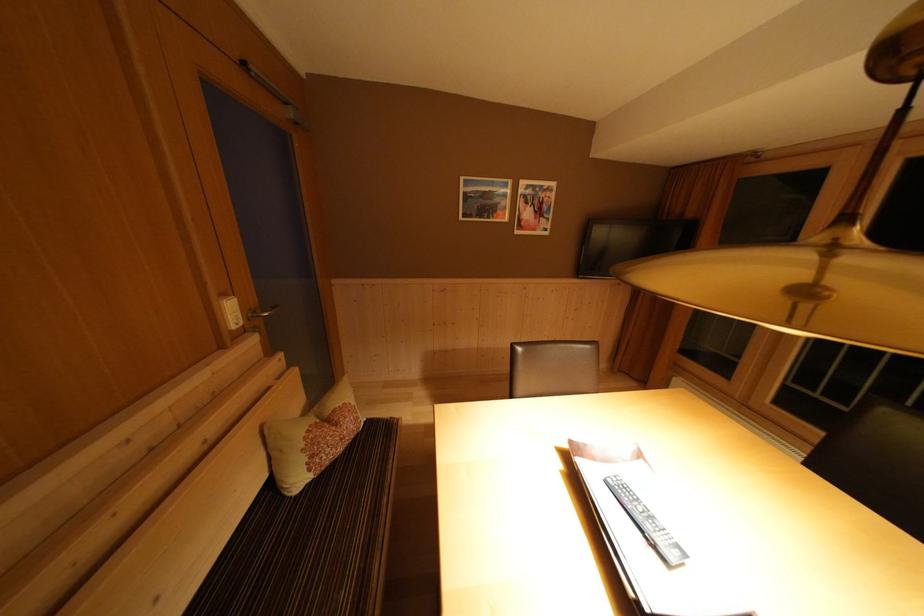
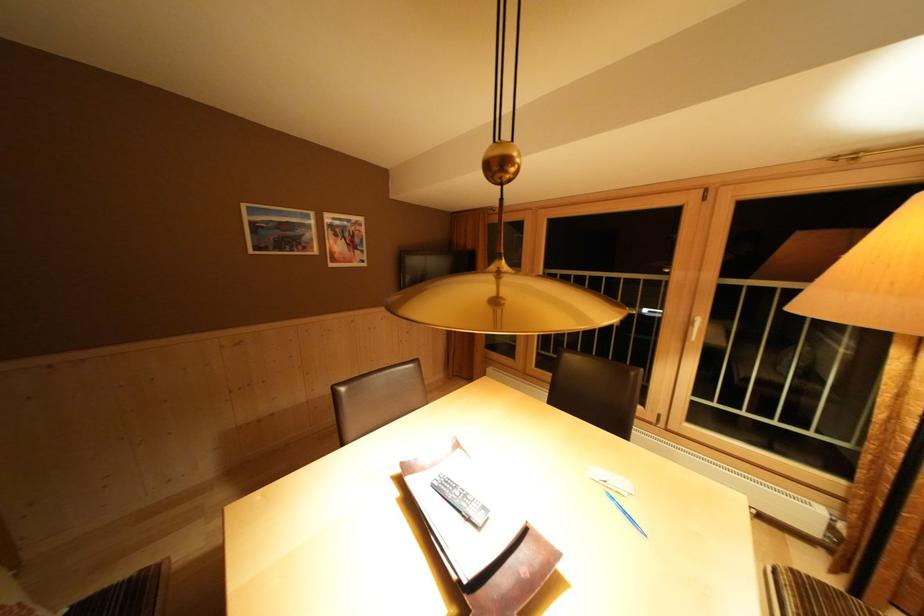
Locate, in the second image, the point that corresponds to [530,357] in the first image.

(355, 395)